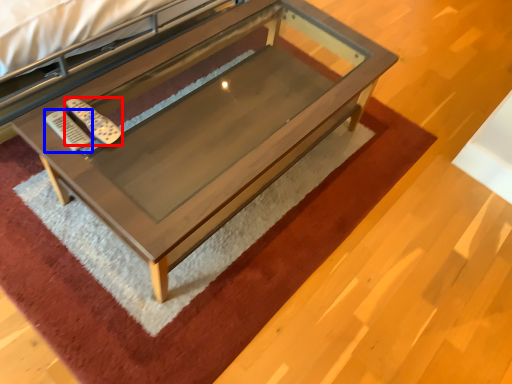
Question: Which point is closer to the camera, remote (highlighted by a red box) or remote (highlighted by a blue box)?

Choices:
 (A) remote
 (B) remote

Answer: (B)